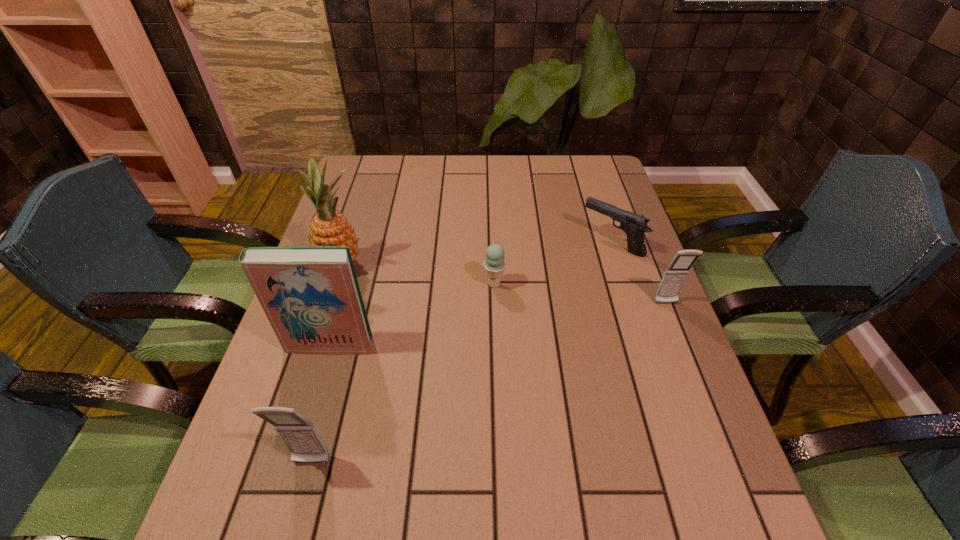
Please point a location where one more cellular_telephone can be added evenly. Please provide its 2D coordinates. Your answer should be formatted as a tuple, i.e. [(x, y)], where the tuple contains the x and y coordinates of a point satisfying the conditions above.

[(515, 372)]